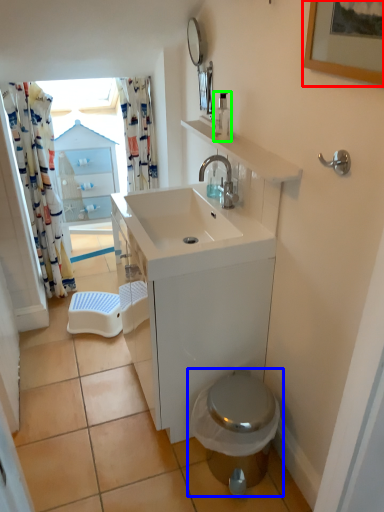
Question: Which is nearer to the picture frame (highlighted by a red box)? toilet (highlighted by a blue box) or soap dispenser (highlighted by a green box).

Choices:
 (A) toilet
 (B) soap dispenser

Answer: (B)